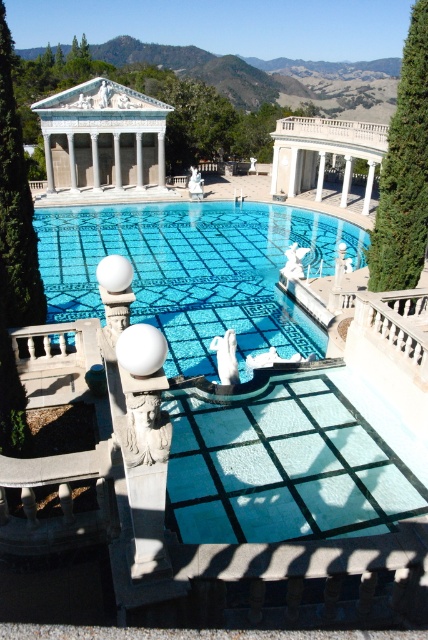
You are a landscape architect designing a new garden. You need to place a tall sculpture in the scene so it doesn not block the view of the blue glass mosaic at center from the green leafy cypress tree at left. Where should you position the sculpture?

The blue glass mosaic at center is much taller than the green leafy cypress tree at left. To avoid blocking the view of the blue glass mosaic at center from the green leafy cypress tree at left, the sculpture should be placed behind the green leafy cypress tree at left or in a position where it doesn not obstruct the line of sight between them.

You are standing in the luxurious outdoor setting with the grand pavilion in the background. You see two points marked in the scene. The first point is at coordinates point [252,330] and the second at point [11,122]. Which of these points is closer to you?

Point [252,330] is closer to you because it is further to the viewer than point [11,122].

Based on the photo, you are standing at the edge of the pool and want to walk to the green leafy cypress tree at left. Which direction should you head towards from your current position near the white marble gazebo at upper center?

Since the white marble gazebo at upper center is located above the green leafy cypress tree at left, you should head downward towards the left to reach the tree.